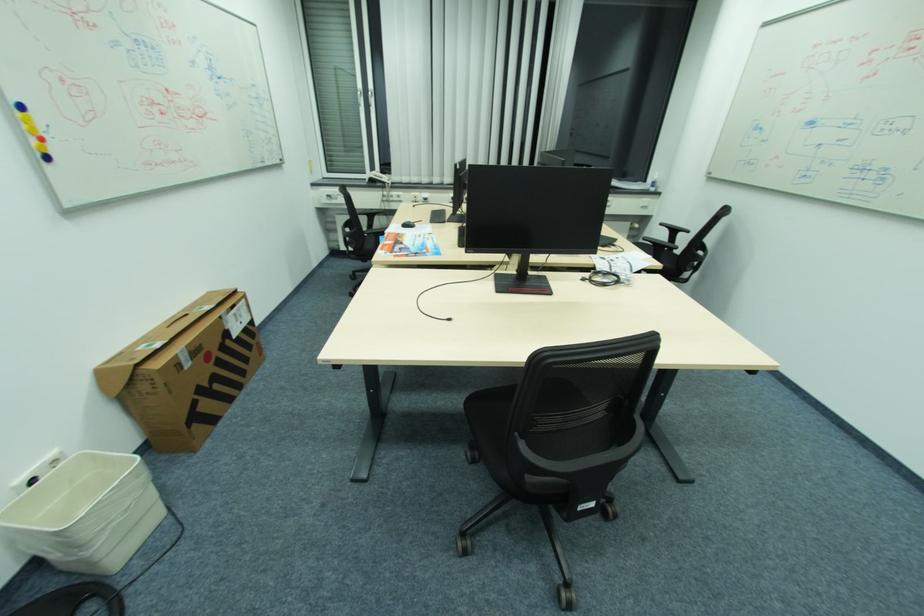
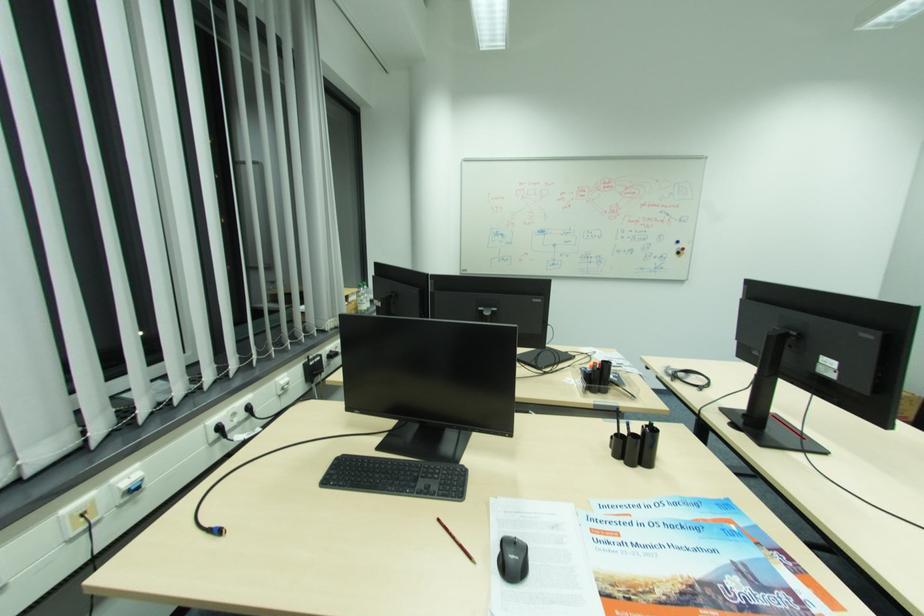
Where in the second image is the point corresponding to pixel 427 199 from the first image?

(124, 496)